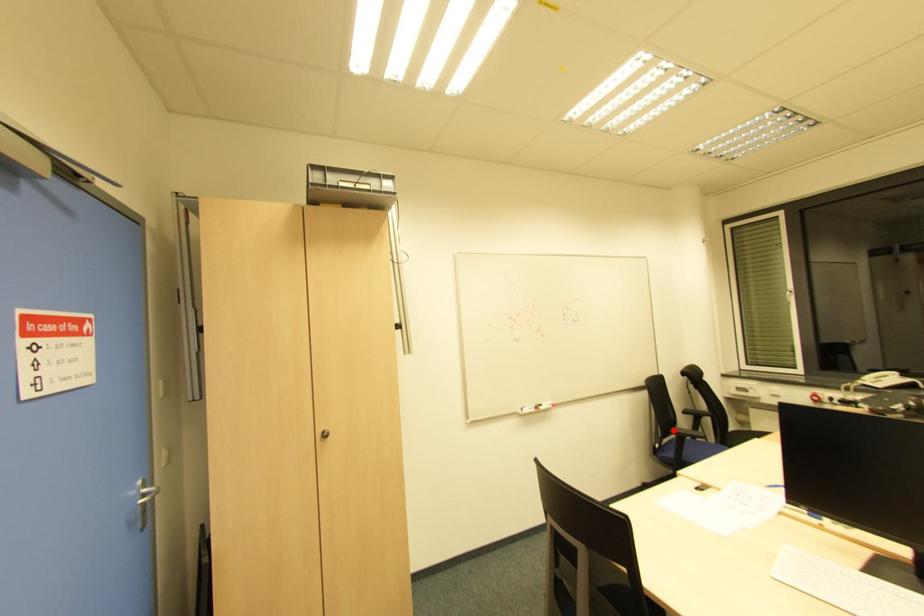
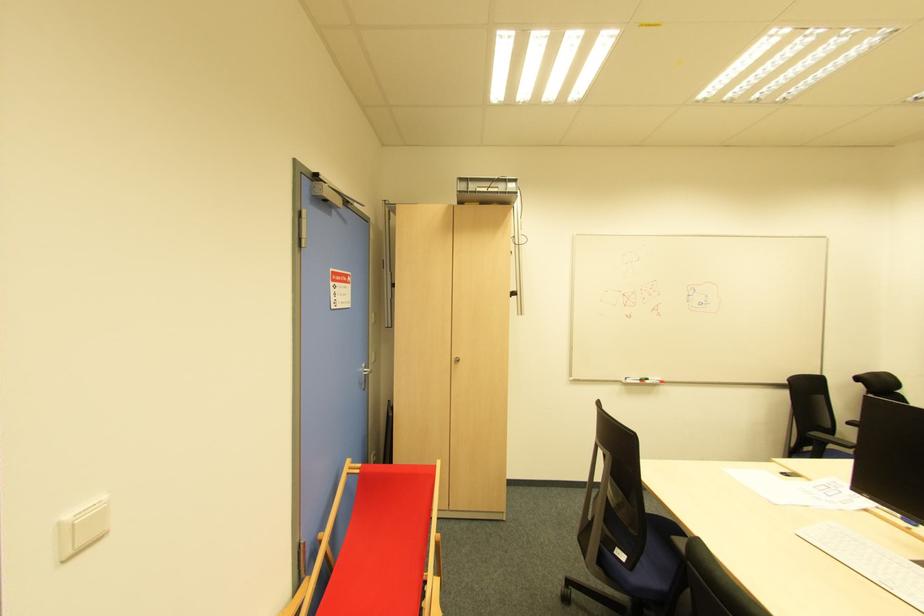
Locate, in the second image, the point that corresponds to the highlighted location in the first image.

(817, 436)